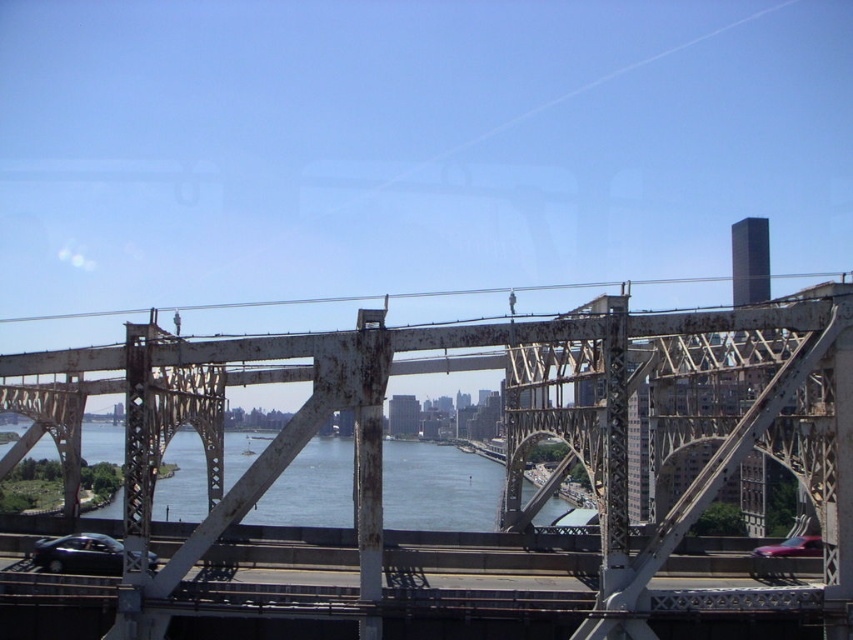
Question: Considering the real-world distances, which object is farthest from the shiny black car at lower left?

Choices:
 (A) shiny red car at lower right
 (B) rusty metal bridge at center
 (C) blue water at center

Answer: (C)

Question: From the image, what is the correct spatial relationship of rusty metal bridge at center in relation to blue water at center?

Choices:
 (A) below
 (B) above

Answer: (B)

Question: Does blue water at center appear on the right side of shiny black car at lower left?

Choices:
 (A) no
 (B) yes

Answer: (A)

Question: Which point appears closest to the camera in this image?

Choices:
 (A) (71, 541)
 (B) (773, 554)

Answer: (A)

Question: Is blue water at center in front of shiny black car at lower left?

Choices:
 (A) yes
 (B) no

Answer: (B)

Question: Which point is closer to the camera taking this photo?

Choices:
 (A) (833, 480)
 (B) (173, 461)
 (C) (96, 564)
 (D) (813, 548)

Answer: (A)